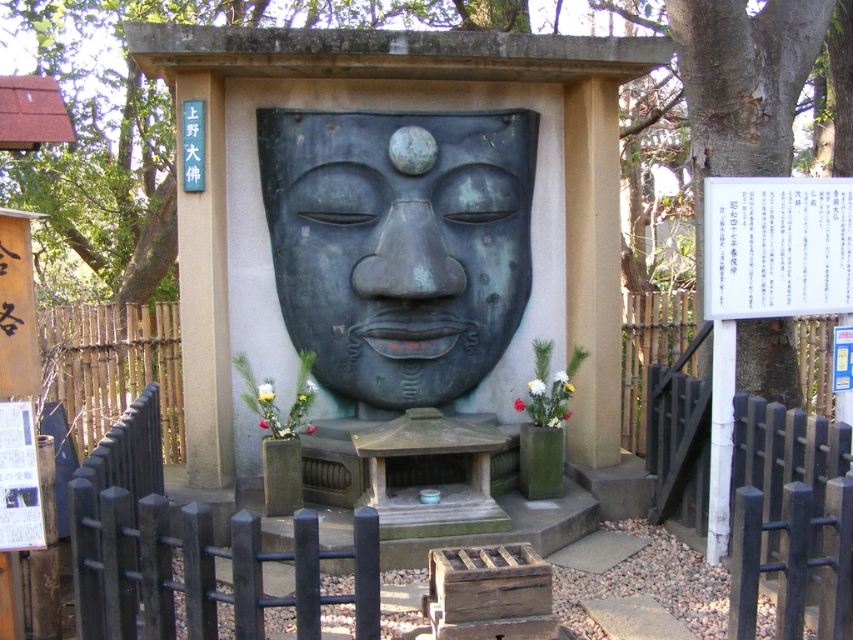
You are standing in front of the bronze mask at center. If you walk directly towards it, will you first encounter its left side or right side?

Since you are facing the bronze mask at center, walking directly towards it means you will approach its front first, so neither the left nor the right side will be encountered first.

You are standing in front of the bronze mask and notice two points marked on the pedestal. The first point is at coordinates point (x=461, y=131) and the second is at point (x=120, y=332). Which point is closer to your current position?

Point (x=461, y=131) is closer to the camera than point (x=120, y=332), so the first point is closer to your current position.